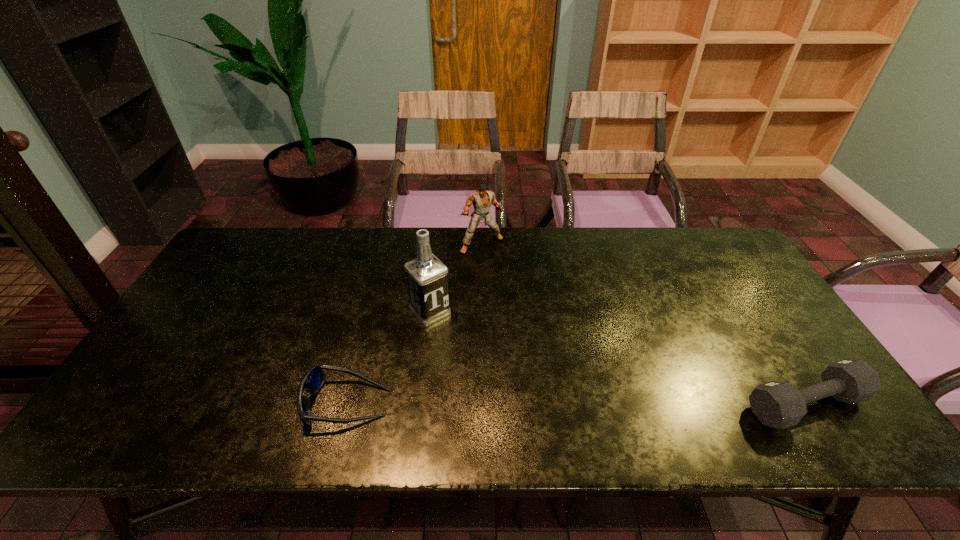
Where is `free space located 0.210m on the front-facing side of the shortest object`? Image resolution: width=960 pixels, height=540 pixels. free space located 0.210m on the front-facing side of the shortest object is located at coordinates (215, 403).

What are the coordinates of `vacant area situated on the back of the dumbbell` in the screenshot? It's located at (748, 314).

Identify the location of free space located on the front label of the second farthest object. The image size is (960, 540). (498, 388).

This screenshot has width=960, height=540. Find the location of `vacant space positioned 0.170m on the front label of the second farthest object`. vacant space positioned 0.170m on the front label of the second farthest object is located at coordinates (477, 364).

Where is `vacant region located 0.190m on the front label of the second farthest object`? This screenshot has height=540, width=960. vacant region located 0.190m on the front label of the second farthest object is located at coordinates (482, 369).

Identify the location of vacant space situated on the front-facing side of the third shortest object. The image size is (960, 540). (518, 300).

At what (x,y) coordinates should I click in order to perform the action: click on vacant point located 0.220m on the front-facing side of the third shortest object. Please return your answer as a coordinate pair (x, y). Looking at the image, I should click on (516, 298).

Identify the location of vacant region located on the front-facing side of the third shortest object. The width and height of the screenshot is (960, 540). (527, 314).

Find the location of a particular element. This screenshot has height=540, width=960. object that is at the far edge is located at coordinates (481, 199).

Identify the location of sunglasses located at the near edge. This screenshot has width=960, height=540. (313, 379).